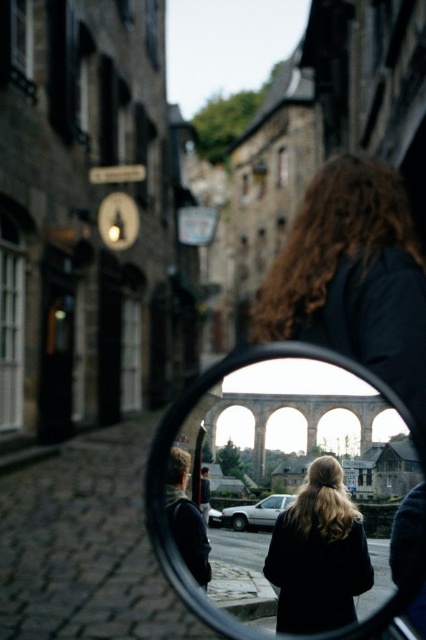
Between clear glass mirror at center and dark wool coat at center, which one has more height?

With more height is clear glass mirror at center.

Who is positioned more to the left, clear glass mirror at center or dark wool coat at center?

Positioned to the left is clear glass mirror at center.

The height and width of the screenshot is (640, 426). What are the coordinates of `clear glass mirror at center` in the screenshot? It's located at (287, 493).